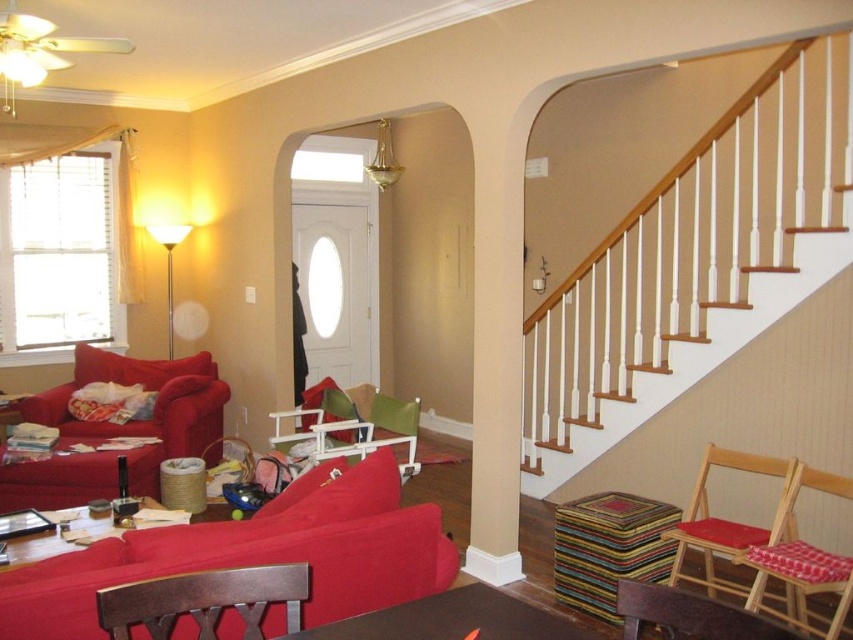
You are moving a large painting that is 1.8 meters wide. You want to place it on the wall between the matte red couch at left and the wooden folding chair with checkered cushion at right. Is there enough space for the painting?

The matte red couch at left has a larger size compared to wooden folding chair with checkered cushion at right. Therefore, the space between them might be sufficient to accommodate the 1.8 meters wide painting, but the exact distance isn

You are a guest entering the living room and want to sit on the velvet red couch at lower left. Which direction should you walk from the matte red couch at left to reach it?

The velvet red couch at lower left is to the right of the matte red couch at left, so you should walk to the right from the matte red couch at left to reach it.

You are a guest in this living room and want to sit down. You see the velvet red couch at lower left and the wooden folding chair at lower right. Which one has a lower seat height?

The velvet red couch at lower left has a lower seat height than the wooden folding chair at lower right because it is shorter.